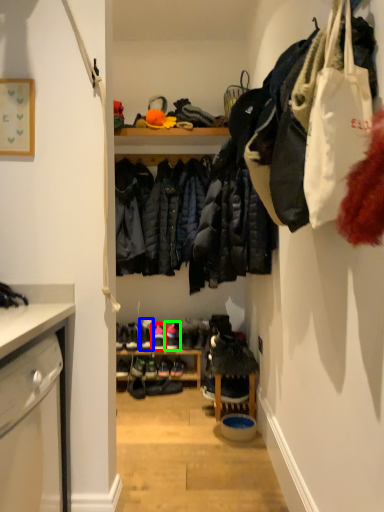
Question: Which object is positioned farthest from footwear (highlighted by a red box)? Select from footwear (highlighted by a blue box) and footwear (highlighted by a green box).

Choices:
 (A) footwear
 (B) footwear

Answer: (A)